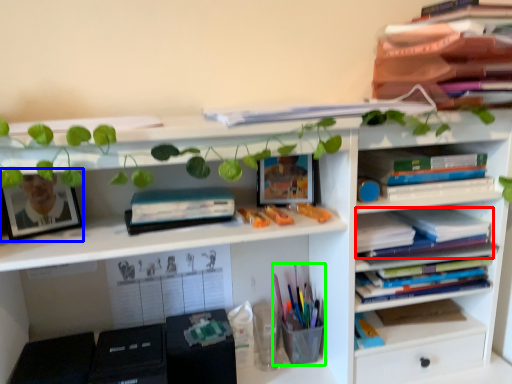
Question: Based on their relative distances, which object is nearer to book (highlighted by a red box)? Choose from picture frame (highlighted by a blue box) and stationery (highlighted by a green box).

Choices:
 (A) picture frame
 (B) stationery

Answer: (B)